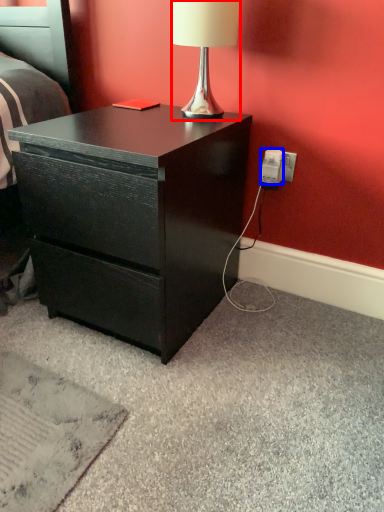
Question: Which object is further to the camera taking this photo, lamp (highlighted by a red box) or power outlet (highlighted by a blue box)?

Choices:
 (A) lamp
 (B) power outlet

Answer: (B)